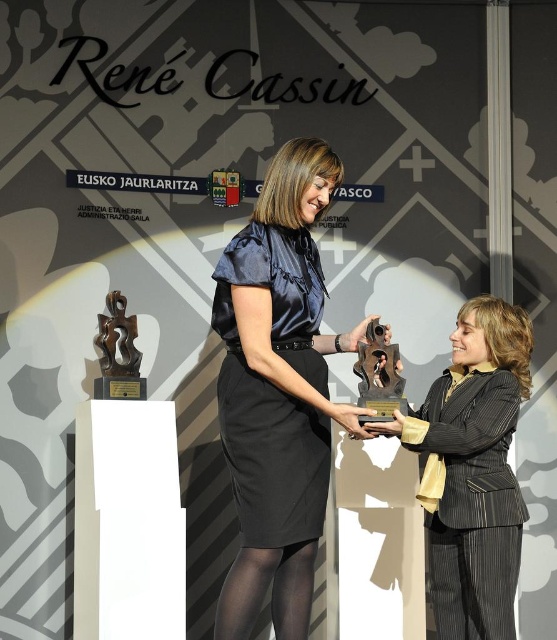
From the picture: Is satin black dress at center smaller than matte gold trophy at center?

No.

Is satin black dress at center shorter than matte gold trophy at center?

In fact, satin black dress at center may be taller than matte gold trophy at center.

Based on the photo, who is more distant from viewer, (290,316) or (500,406)?

Positioned behind is point (500,406).

Find the location of a particular element. The height and width of the screenshot is (640, 557). satin black dress at center is located at coordinates (278, 392).